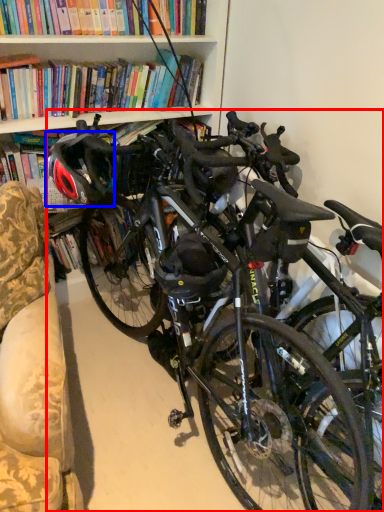
Question: Which object appears farthest to the camera in this image, bicycle (highlighted by a red box) or bicycle helmet (highlighted by a blue box)?

Choices:
 (A) bicycle
 (B) bicycle helmet

Answer: (B)